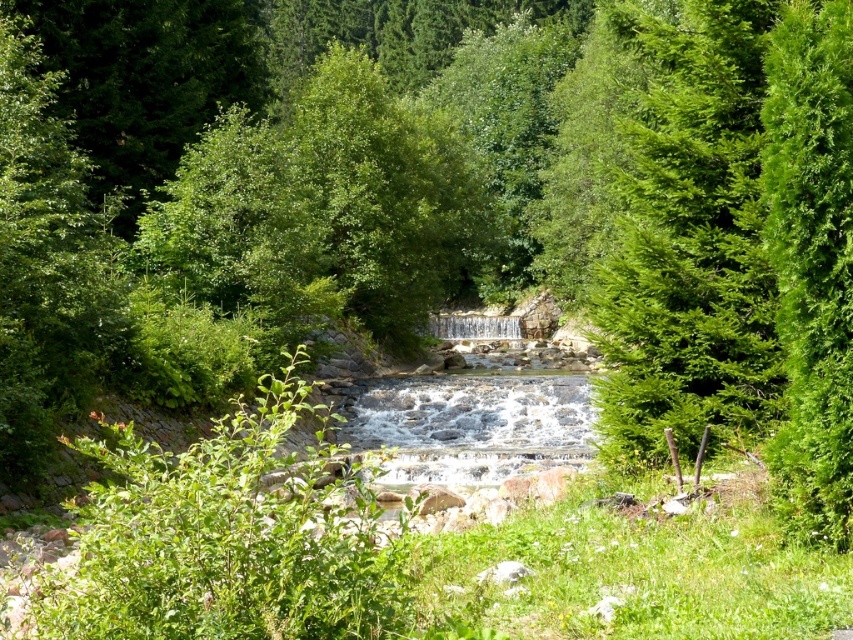
You are standing in the forest looking at the waterfall. Where is the green leafy tree at right located in the scene?

The green leafy tree at right is located at the 2D coordinates point [688,237] in the scene.

You are standing in front of the waterfall and want to reach the two points marked in the image. Which point, point (712, 182) or point (833, 236), is closer to you?

Point (712, 182) is closer to you because it is further to the camera than point (833, 236), meaning it is nearer in the scene.